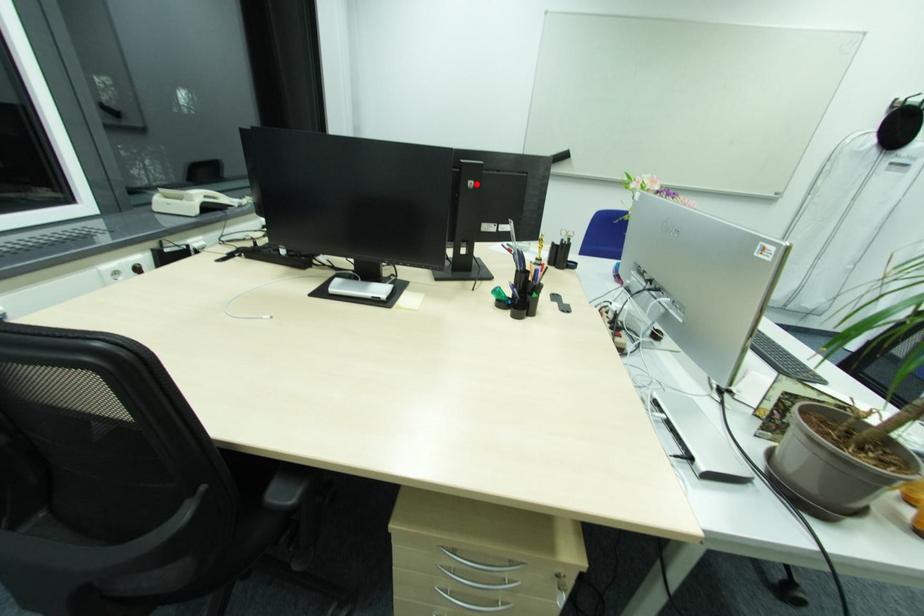
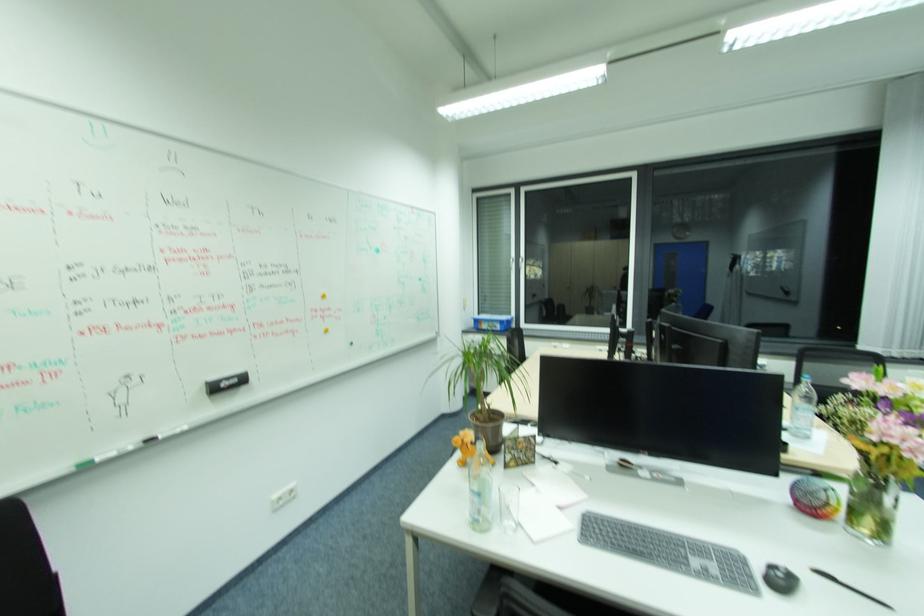
Find the pixel in the second image that matches the highlighted location in the first image.

(666, 334)